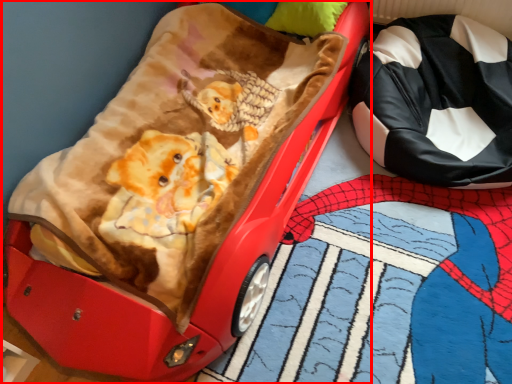
Question: From the image, what is the correct spatial relationship of furniture (annotated by the red box) in relation to pillow?

Choices:
 (A) right
 (B) left

Answer: (B)